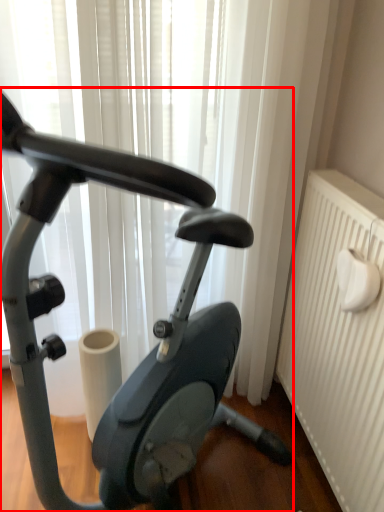
Question: From the image's perspective, what is the correct spatial relationship of stationary bicycle (annotated by the red box) in relation to radiator?

Choices:
 (A) below
 (B) above

Answer: (B)